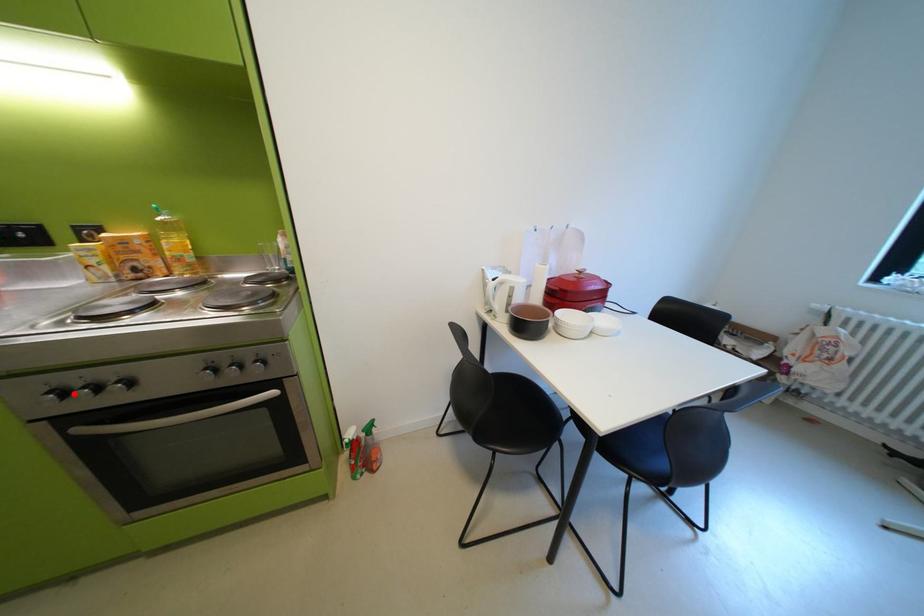
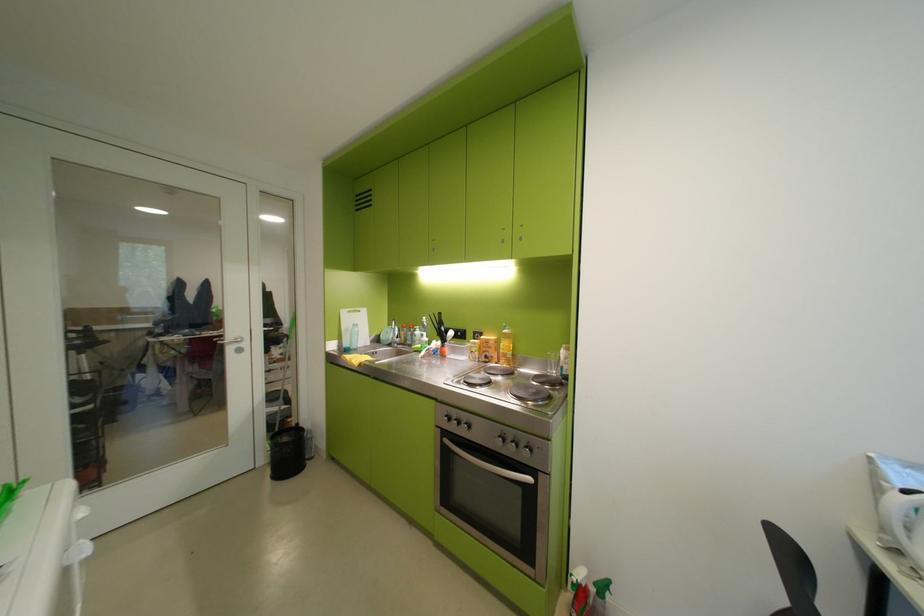
The point at the highlighted location is marked in the first image. Where is the corresponding point in the second image?

(459, 419)